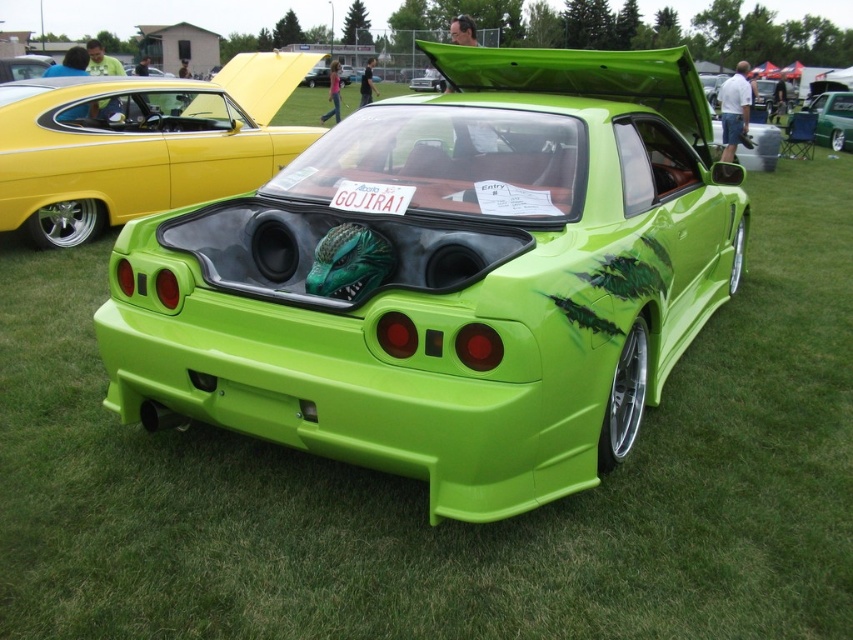
Question: Which point is farther to the camera?

Choices:
 (A) click(x=831, y=96)
 (B) click(x=350, y=180)
 (C) click(x=283, y=150)

Answer: (A)

Question: In this image, where is green matte sports car at center located relative to green matte license plate at center?

Choices:
 (A) right
 (B) left

Answer: (B)

Question: Does green matte sports car at center appear on the left side of green matte license plate at center?

Choices:
 (A) no
 (B) yes

Answer: (B)

Question: Does green matte license plate at center lie in front of metallic green car at upper right?

Choices:
 (A) no
 (B) yes

Answer: (B)

Question: Considering the real-world distances, which object is closest to the green matte sports car at center?

Choices:
 (A) metallic green car at upper right
 (B) green matte license plate at center

Answer: (B)

Question: Which point appears closest to the camera in this image?

Choices:
 (A) (229, 109)
 (B) (840, 131)
 (C) (373, 212)

Answer: (C)